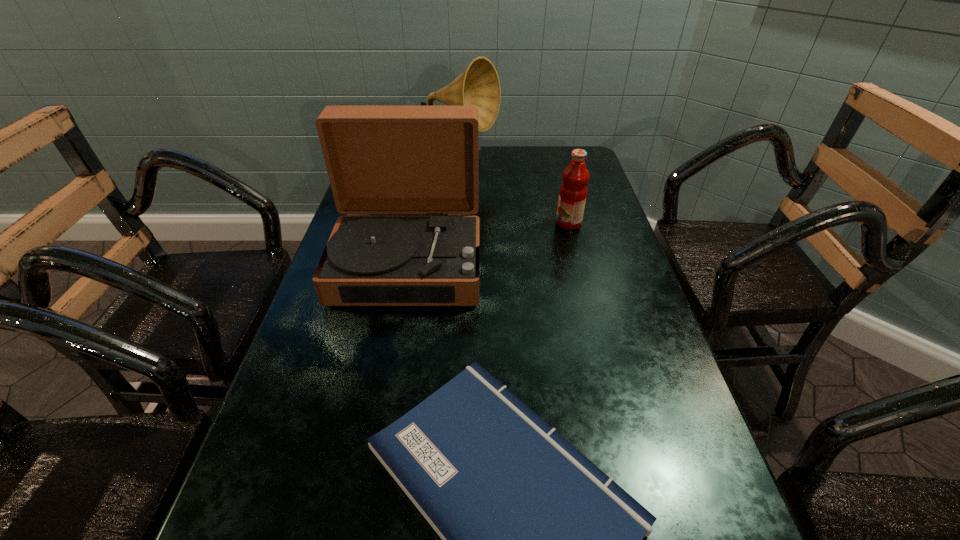
The height and width of the screenshot is (540, 960). I want to click on object that is at the right edge, so click(x=573, y=191).

This screenshot has width=960, height=540. I want to click on vacant region at the far edge, so click(481, 160).

Image resolution: width=960 pixels, height=540 pixels. What are the coordinates of `blank space at the right edge of the desktop` in the screenshot? It's located at (636, 419).

Find the location of a particular element. The width and height of the screenshot is (960, 540). vacant area that lies between the nearer phonograph record and the farther phonograph record is located at coordinates (434, 214).

This screenshot has height=540, width=960. I want to click on vacant area between the fruit juice and the farther phonograph record, so click(x=515, y=194).

Locate an element on the screen. unoccupied position between the nearer phonograph record and the fruit juice is located at coordinates (489, 244).

At what (x,y) coordinates should I click in order to perform the action: click on free spot between the farther phonograph record and the third tallest object. Please return your answer as a coordinate pair (x, y). The width and height of the screenshot is (960, 540). Looking at the image, I should click on (515, 194).

At what (x,y) coordinates should I click in order to perform the action: click on object that is the second closest one to the farther phonograph record. Please return your answer as a coordinate pair (x, y). This screenshot has width=960, height=540. Looking at the image, I should click on (573, 191).

Identify the location of the third closest object to the paperback book. The image size is (960, 540). (479, 85).

You are a GUI agent. You are given a task and a screenshot of the screen. Output one action in this format:
    pyautogui.click(x=<x>, y=<y>)
    Task: Click on the free space that satisfies the following two spatial constraints: 1. on the front label of the third tallest object; 2. on the face of the nearer phonograph record
    The image size is (960, 540).
    Given the screenshot: What is the action you would take?
    pyautogui.click(x=579, y=264)